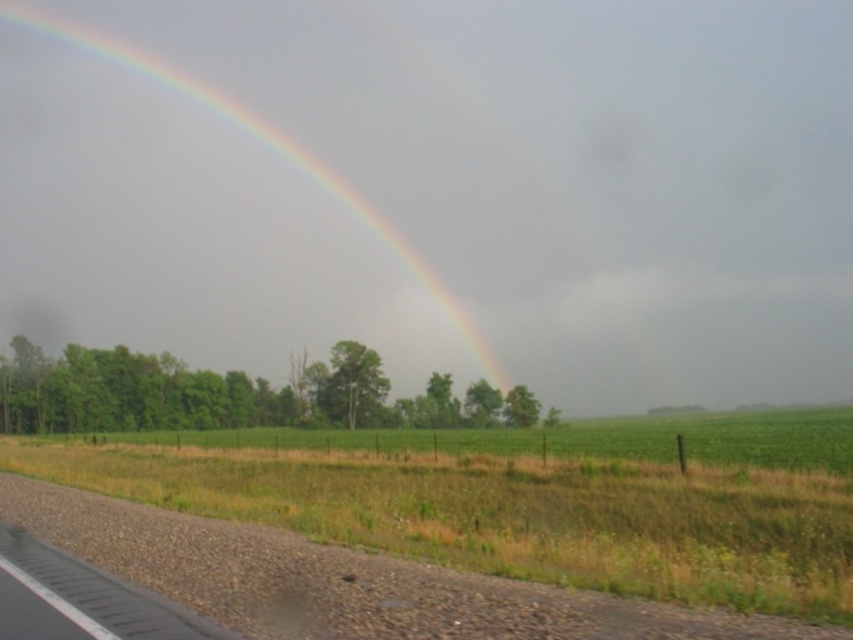
Question: Which point is farther to the camera?

Choices:
 (A) green grass at lower center
 (B) rainbow at upper center

Answer: (B)

Question: Which point is closer to the camera?

Choices:
 (A) green grass at lower center
 (B) rainbow at upper center

Answer: (A)

Question: Is rainbow at upper center smaller than green grass at lower center?

Choices:
 (A) no
 (B) yes

Answer: (A)

Question: In this image, where is rainbow at upper center located relative to green grass at lower center?

Choices:
 (A) below
 (B) above

Answer: (B)

Question: Observing the image, what is the correct spatial positioning of rainbow at upper center in reference to green grass at lower center?

Choices:
 (A) left
 (B) right

Answer: (A)